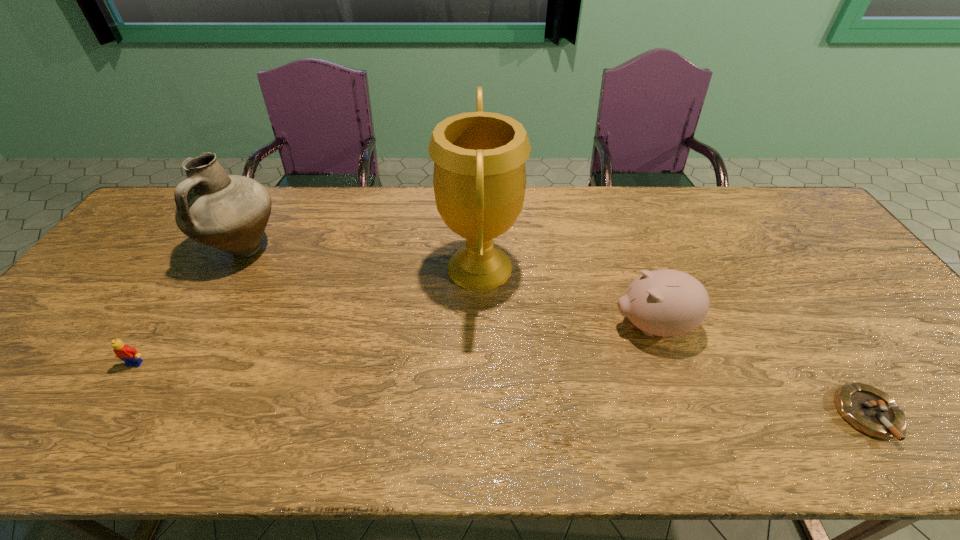
Find the location of a particular element. Image resolution: width=960 pixels, height=540 pixels. the third object from left to right is located at coordinates (479, 179).

The height and width of the screenshot is (540, 960). Identify the location of the tallest object. (479, 179).

Image resolution: width=960 pixels, height=540 pixels. Identify the location of the second tallest object. point(229,212).

Locate an element on the screen. Image resolution: width=960 pixels, height=540 pixels. the fourth object from left to right is located at coordinates (665, 302).

Where is `the third tallest object`? This screenshot has height=540, width=960. the third tallest object is located at coordinates (665, 302).

The image size is (960, 540). I want to click on Lego, so click(129, 355).

Where is `the second nearest object`? the second nearest object is located at coordinates (129, 355).

Where is `the rightmost object`? the rightmost object is located at coordinates (868, 409).

Find the location of a particular element. the shortest object is located at coordinates (868, 409).

You are a GUI agent. You are given a task and a screenshot of the screen. Output one action in this format:
    pyautogui.click(x=<x>, y=<y>)
    Task: Click on the vacant space situated 0.150m on the engravings side of the tallest object
    This screenshot has height=540, width=960.
    Given the screenshot: What is the action you would take?
    pyautogui.click(x=572, y=267)